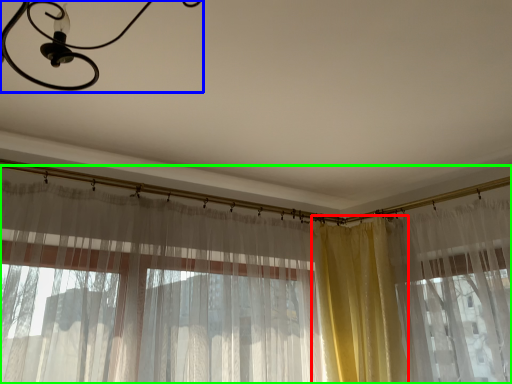
Question: Considering the real-world distances, which object is closest to curtain (highlighted by a red box)? light fixture (highlighted by a blue box) or curtain (highlighted by a green box).

Choices:
 (A) light fixture
 (B) curtain

Answer: (B)